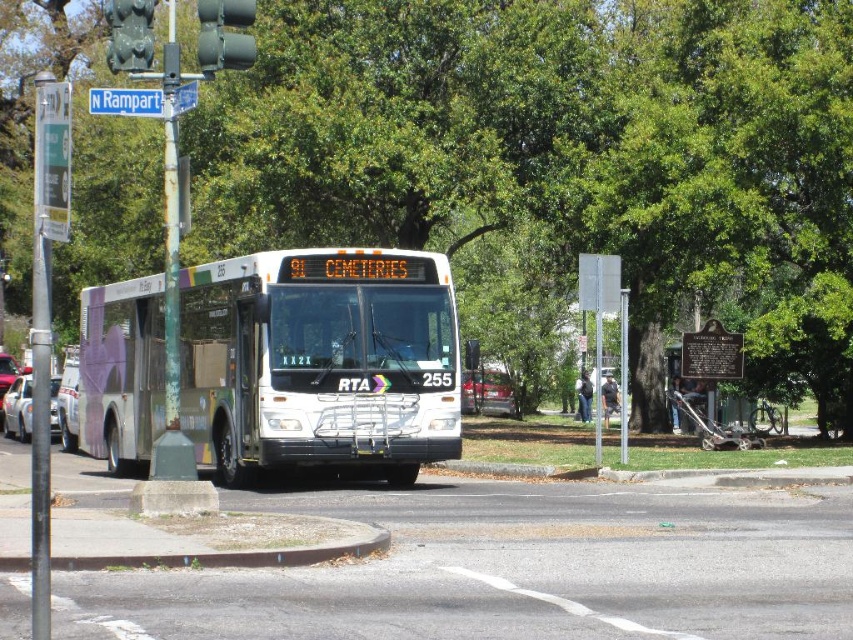
You are standing at the intersection and want to take the bus to the Cemeteries. Where exactly is the white matte bus at center located in the image?

The white matte bus at center is located at point (320,360) in the image.

You are standing at the bus stop and want to know how far the point marked at coordinates (254,408) is from where you are standing. Can you determine the distance?

The point marked at coordinates (254,408) is 51.94 feet away from the viewer.

You are a pedestrian waiting at the curb. You see a green leafy tree at center and a white glossy sedan at left. Which object is closer to your right side?

The green leafy tree at center is closer to your right side because it is positioned to the right of the white glossy sedan at left.